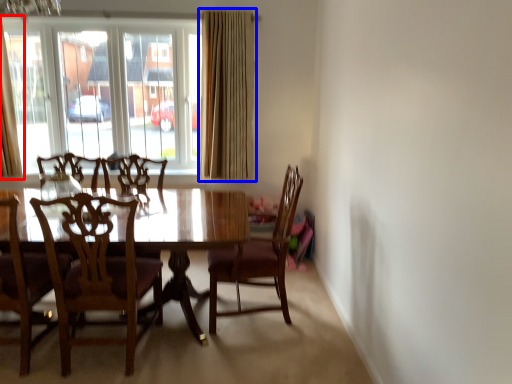
Question: Which of the following is the closest to the observer, curtain (highlighted by a red box) or curtain (highlighted by a blue box)?

Choices:
 (A) curtain
 (B) curtain

Answer: (A)